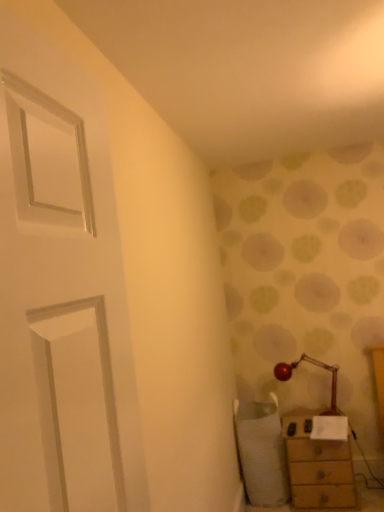
Question: Based on their positions, is white textured swivel chair at lower right located to the left or right of wooden chest of drawers at lower right?

Choices:
 (A) left
 (B) right

Answer: (A)

Question: From the image's perspective, is white textured swivel chair at lower right positioned above or below wooden chest of drawers at lower right?

Choices:
 (A) above
 (B) below

Answer: (A)

Question: Estimate the real-world distances between objects in this image. Which object is farther from the wooden chest of drawers at lower right?

Choices:
 (A) metallic red table lamp at lower right
 (B) white textured swivel chair at lower right

Answer: (A)

Question: Estimate the real-world distances between objects in this image. Which object is farther from the metallic red table lamp at lower right?

Choices:
 (A) white textured swivel chair at lower right
 (B) wooden chest of drawers at lower right

Answer: (A)